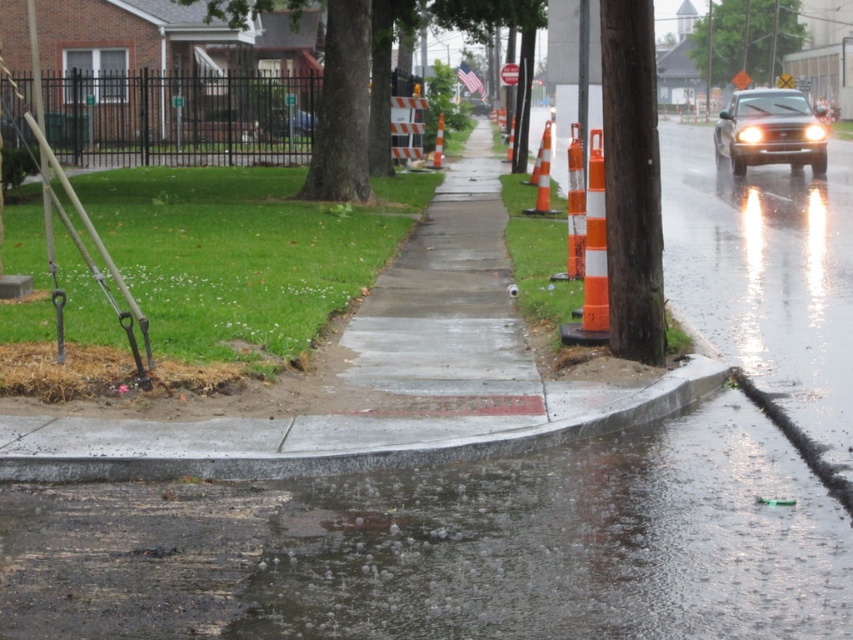
Who is more forward, [550,124] or [512,138]?

Point [550,124]

Does orange reflective traffic cone at center-right have a greater height compared to orange reflective traffic cone at center?

Correct, orange reflective traffic cone at center-right is much taller as orange reflective traffic cone at center.

Describe the element at coordinates (538, 156) in the screenshot. This screenshot has width=853, height=640. I see `orange reflective traffic cone at center-right` at that location.

Where is `orange reflective traffic cone at center-right`? This screenshot has width=853, height=640. orange reflective traffic cone at center-right is located at coordinates (538, 156).

Between point (627, 412) and point (814, 134), which one is positioned behind?

Positioned behind is point (814, 134).

Find the location of a particular element. gray concrete curb at lower center is located at coordinates (325, 436).

Between gray concrete curb at lower center and orange reflective cone at center, which one appears on the left side from the viewer's perspective?

Positioned to the left is orange reflective cone at center.

Can you confirm if gray concrete curb at lower center is positioned below orange reflective cone at center?

Yes, gray concrete curb at lower center is below orange reflective cone at center.

Who is more distant from viewer, (694, 356) or (436, 141)?

The point (436, 141) is more distant.

The width and height of the screenshot is (853, 640). What are the coordinates of `gray concrete curb at lower center` in the screenshot? It's located at (325, 436).